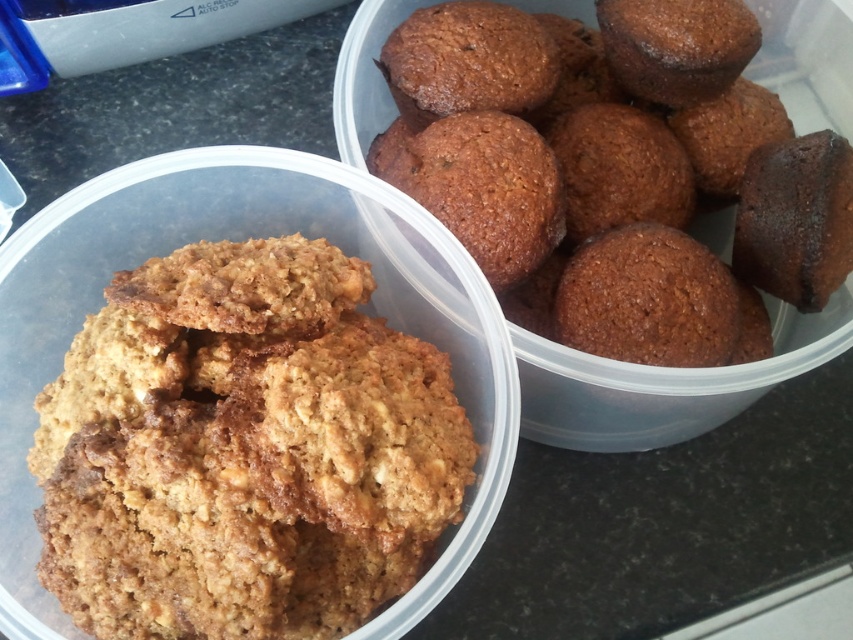
Is golden brown textured cookies at center smaller than brown matte muffin at upper right?

Correct, golden brown textured cookies at center occupies less space than brown matte muffin at upper right.

Between golden brown textured cookies at center and brown matte muffin at upper right, which one has more height?

Standing taller between the two is brown matte muffin at upper right.

Image resolution: width=853 pixels, height=640 pixels. Identify the location of golden brown textured cookies at center. (238, 240).

This screenshot has width=853, height=640. Identify the location of golden brown textured cookies at center. [x=238, y=240].